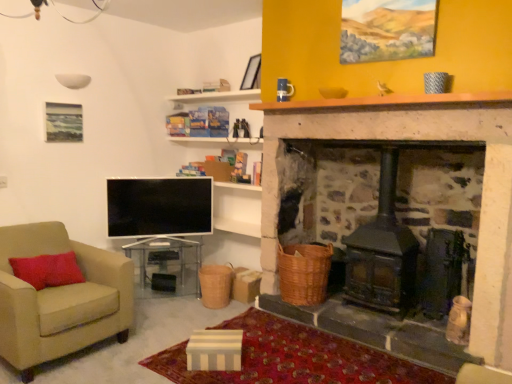
In order to click on vacant area that is situated to the right of beige fabric armchair at left in this screenshot , I will do `click(148, 339)`.